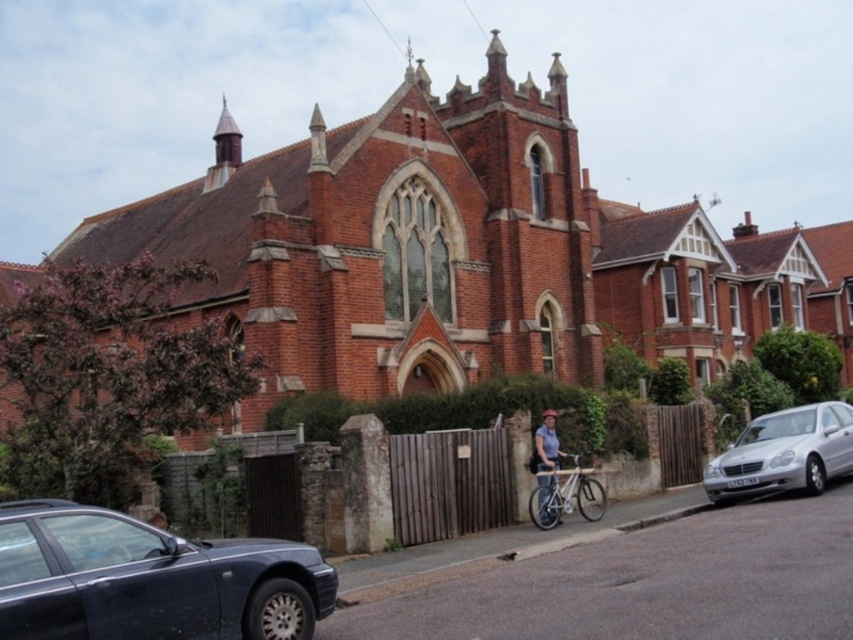
Is red brick church at center thinner than light brown wooden bicycle at center?

No.

Who is positioned more to the right, red brick church at center or light brown wooden bicycle at center?

From the viewer's perspective, light brown wooden bicycle at center appears more on the right side.

Is point (494, 97) in front of point (550, 436)?

No, it is not.

Locate an element on the screen. The height and width of the screenshot is (640, 853). red brick church at center is located at coordinates (463, 252).

Who is lower down, silver metallic car at right or light brown wooden bicycle at center?

silver metallic car at right

Where is `silver metallic car at right`? silver metallic car at right is located at coordinates (784, 452).

You are a GUI agent. You are given a task and a screenshot of the screen. Output one action in this format:
    pyautogui.click(x=<x>, y=<y>)
    Task: Click on the silver metallic car at right
    
    Given the screenshot: What is the action you would take?
    tap(784, 452)

I want to click on silver metallic car at right, so click(x=784, y=452).

Find the location of a particular element. shiny dark blue sedan at lower left is located at coordinates (149, 579).

Is shiny dark blue sedan at lower left bigger than light brown wooden bicycle at center?

Yes.

The image size is (853, 640). What do you see at coordinates (149, 579) in the screenshot?
I see `shiny dark blue sedan at lower left` at bounding box center [149, 579].

Image resolution: width=853 pixels, height=640 pixels. I want to click on shiny dark blue sedan at lower left, so click(x=149, y=579).